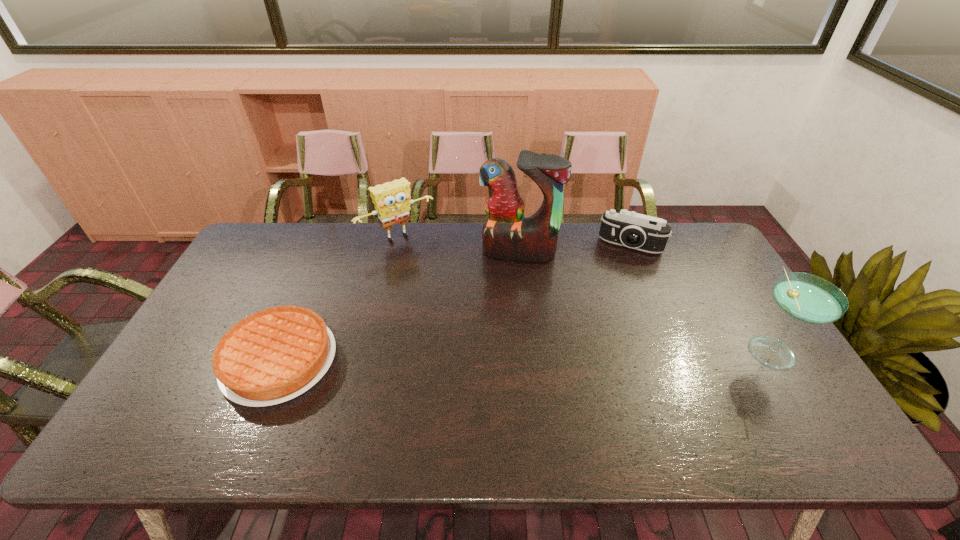
Where is `the shortest object`? the shortest object is located at coordinates (272, 356).

Find the location of a particular element. The image size is (960, 540). the rightmost object is located at coordinates (807, 298).

Find the location of a particular element. the tallest object is located at coordinates (507, 234).

Find the location of a particular element. parrot is located at coordinates (507, 234).

Locate an element on the screen. The width and height of the screenshot is (960, 540). sponge is located at coordinates (392, 202).

Find the location of a particular element. the second object from right to left is located at coordinates (629, 229).

Where is `camera`? This screenshot has height=540, width=960. camera is located at coordinates (629, 229).

Find the location of a particular element. This screenshot has height=540, width=960. vacant area situated 0.050m on the left of the shortest object is located at coordinates (205, 361).

Where is `blank space located on the left of the martini`? Image resolution: width=960 pixels, height=540 pixels. blank space located on the left of the martini is located at coordinates (635, 349).

Identify the location of vacant space located at the face of the third object from right to left. The image size is (960, 540). (506, 285).